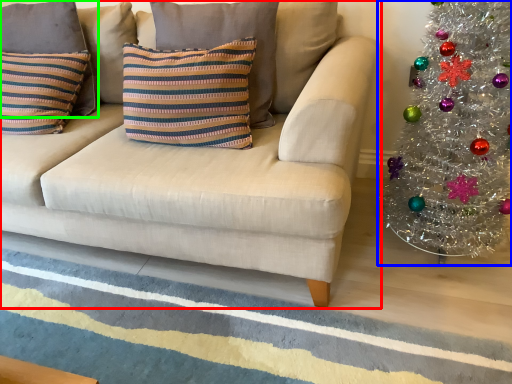
Question: Estimate the real-world distances between objects in this image. Which object is closer to studio couch (highlighted by a red box), christmas tree (highlighted by a blue box) or pillow (highlighted by a green box)?

Choices:
 (A) christmas tree
 (B) pillow

Answer: (B)